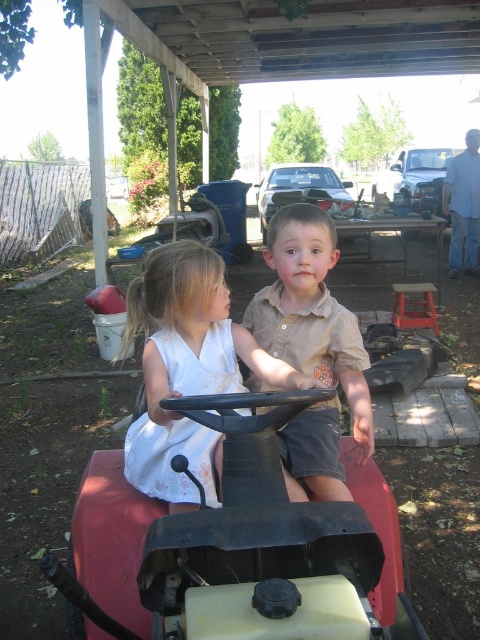
You are a drone operator trying to capture aerial footage of the scene. The drone is currently at a position above the wooden pergola. To ensure the matte plastic toy car at center is in the frame, where should you position the drone relative to the toy car?

The drone should be positioned above the matte plastic toy car at center to ensure it is in the frame.

You are planning to place a new small potted plant between the matte plastic toy car at center and the metallic silver truck at upper right. Given their sizes, which object will require more space between them to accommodate the plant?

The metallic silver truck at upper right requires more space between them because it has a greater width than the matte plastic toy car at center.